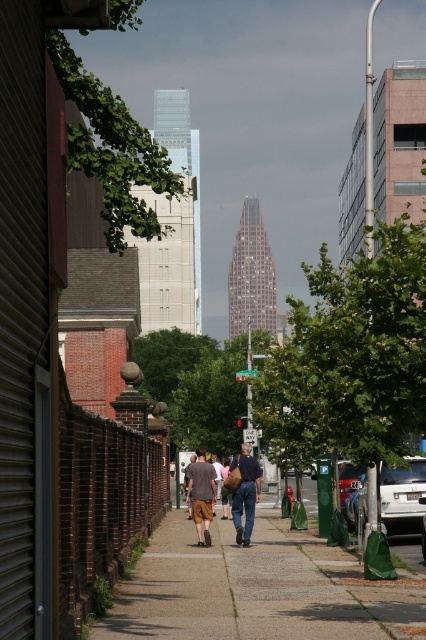
You are standing at the entrance of the building with a corrugated metal facade and want to walk to the gray concrete sidewalk at center. Which direction should you head towards?

The gray concrete sidewalk at center is located at point (253, 588), so you should head towards the center of the image to reach it.

You are standing on the sidewalk in the city scene and want to determine which of the two points, point (181,604) or point (423,486), is nearer to you. Based on the scene description, which point is closer?

Point (181,604) is closer to the viewer than point (423,486).

You are standing on the sidewalk in the city scene. There are two points marked on the image. The first point is at coordinate point (x=242, y=460) and the second is at point (x=345, y=468). Which point is closer to you?

Point (x=242, y=460) is closer to the viewer than point (x=345, y=468).